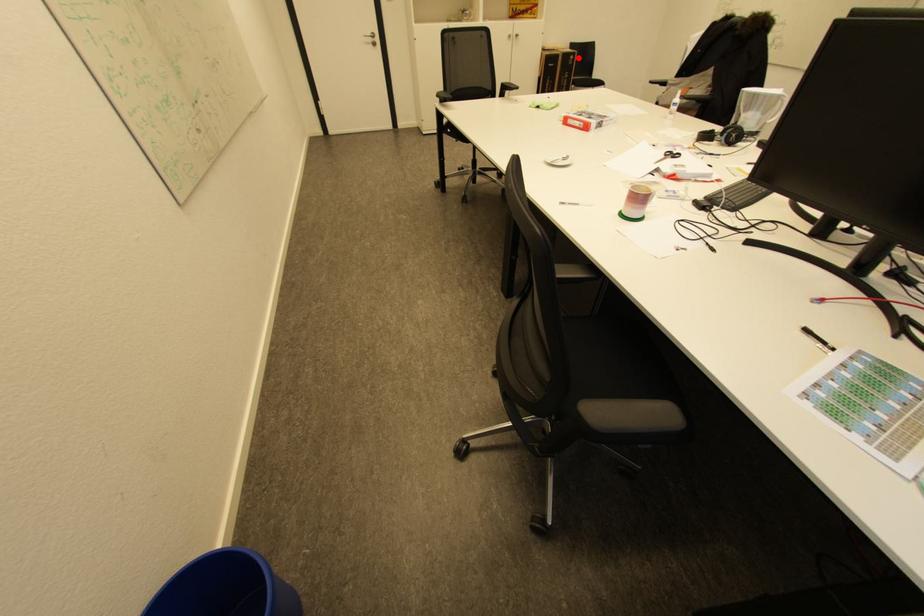
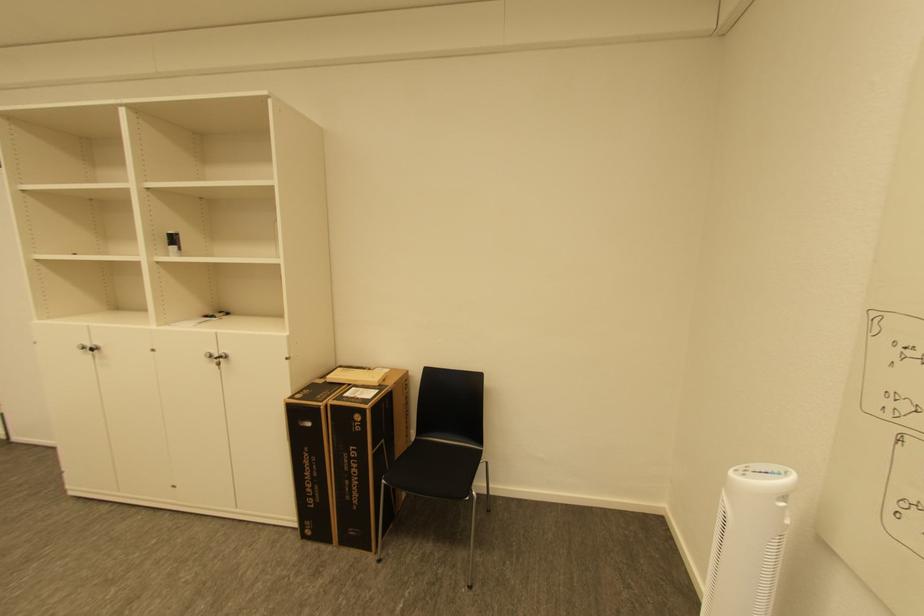
Question: A red point is marked in image1. In image2, is the corresponding 3D point closer to the camera or farther? Reply with the corresponding letter.

Choices:
 (A) The corresponding 3D point is closer.
 (B) The corresponding 3D point is farther.

Answer: (B)